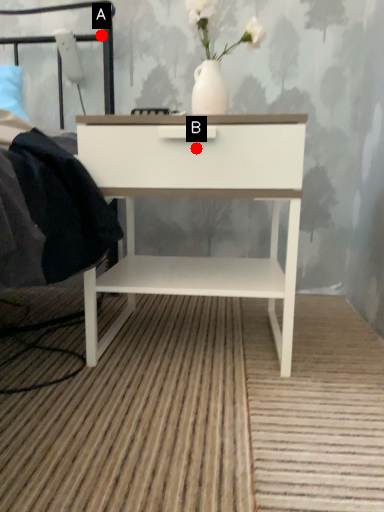
Question: Two points are circled on the image, labeled by A and B beside each circle. Which of the following is the farthest from the observer?

Choices:
 (A) A is further
 (B) B is further

Answer: (A)